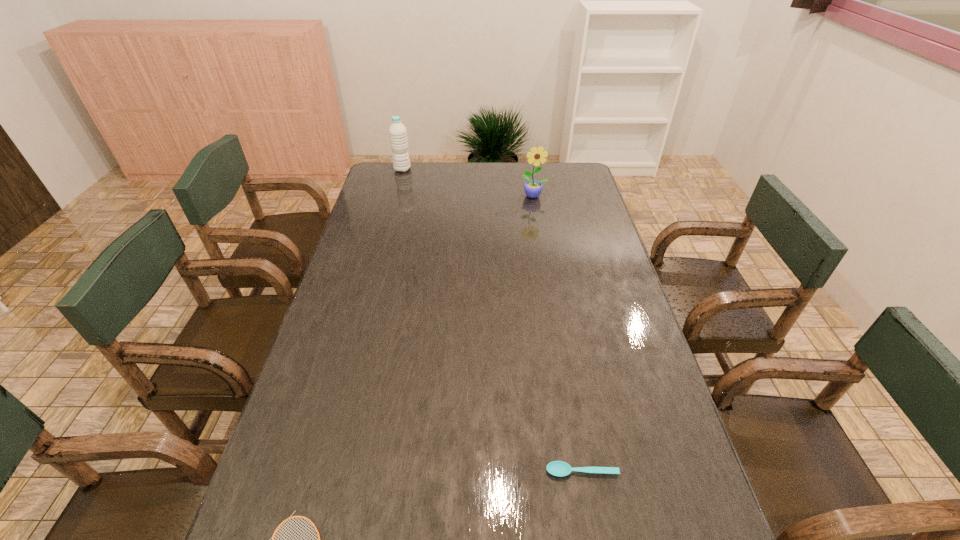
Identify the location of water bottle. (397, 131).

The width and height of the screenshot is (960, 540). I want to click on sunflower, so click(533, 188).

At what (x,y) coordinates should I click in order to perform the action: click on the third farthest object. Please return your answer as a coordinate pair (x, y). The height and width of the screenshot is (540, 960). Looking at the image, I should click on (556, 468).

This screenshot has width=960, height=540. I want to click on spoon, so click(556, 468).

You are a GUI agent. You are given a task and a screenshot of the screen. Output one action in this format:
    pyautogui.click(x=<x>, y=<y>)
    Task: Click on the free region located 0.330m on the right of the farthest object
    This screenshot has height=540, width=960.
    Given the screenshot: What is the action you would take?
    pyautogui.click(x=488, y=170)

I want to click on free location located on the front-facing side of the third nearest object, so click(x=545, y=260).

This screenshot has width=960, height=540. I want to click on free space located on the right of the spoon, so click(688, 471).

At what (x,y) coordinates should I click in order to perform the action: click on object that is at the far edge. Please return your answer as a coordinate pair (x, y). The height and width of the screenshot is (540, 960). Looking at the image, I should click on (397, 131).

Where is `object that is at the left edge`? This screenshot has width=960, height=540. object that is at the left edge is located at coordinates (397, 131).

In order to click on object situated at the right edge in this screenshot , I will do `click(556, 468)`.